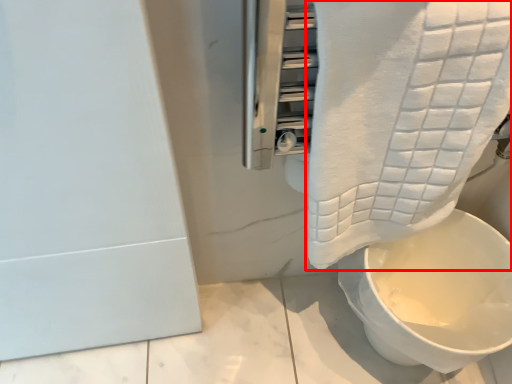
Question: From the image's perspective, where is towel (annotated by the red box) located in relation to toilet in the image?

Choices:
 (A) above
 (B) below

Answer: (A)